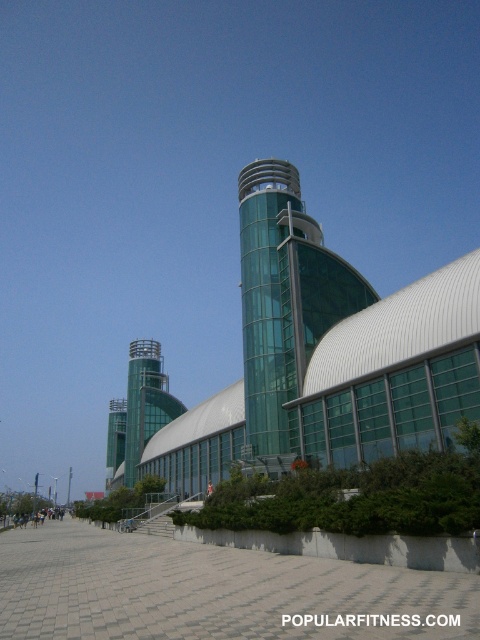
Is transparent glass tower at center thinner than green glass tower at center?

Yes.

Between transparent glass tower at center and green glass tower at center, which one appears on the left side from the viewer's perspective?

green glass tower at center is more to the left.

The width and height of the screenshot is (480, 640). What are the coordinates of `transparent glass tower at center` in the screenshot? It's located at (284, 305).